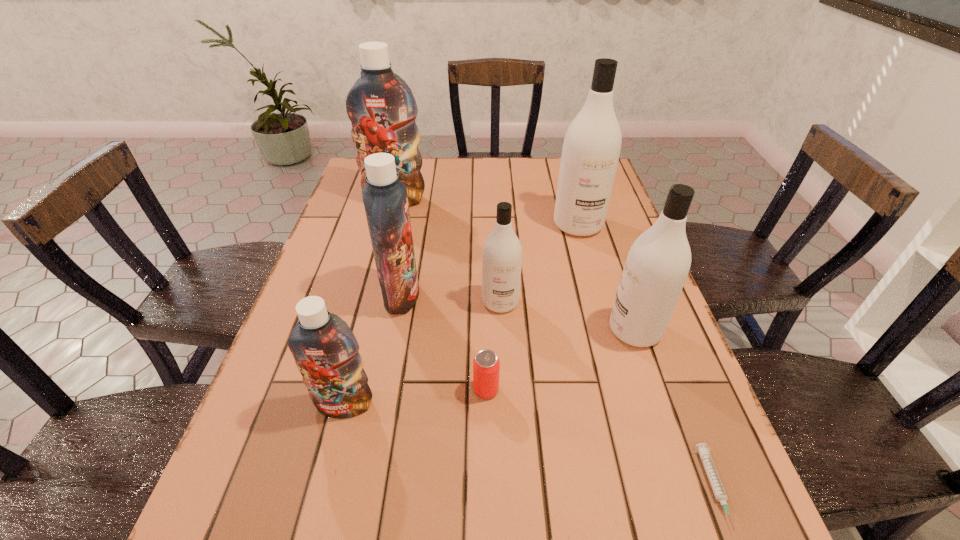
Image resolution: width=960 pixels, height=540 pixels. What are the coordinates of `the second farthest object` in the screenshot? It's located at (591, 149).

Locate an element on the screen. The image size is (960, 540). the second farthest shampoo is located at coordinates (591, 149).

The image size is (960, 540). I want to click on the farthest object, so click(381, 107).

Identify the location of the biggest blue shampoo. (381, 107).

Identify the location of the second smallest blue shampoo. This screenshot has width=960, height=540. (385, 199).

Where is `the second biggest white shampoo`? This screenshot has height=540, width=960. the second biggest white shampoo is located at coordinates (657, 265).

Locate an element on the screen. The width and height of the screenshot is (960, 540). the nearest blue shampoo is located at coordinates pyautogui.click(x=326, y=352).

Where is `the smallest blue shampoo`? This screenshot has height=540, width=960. the smallest blue shampoo is located at coordinates (326, 352).

Where is `the fourth shampoo from left to right`? the fourth shampoo from left to right is located at coordinates (502, 252).

Where is `the smallest white shampoo`? Image resolution: width=960 pixels, height=540 pixels. the smallest white shampoo is located at coordinates (502, 252).